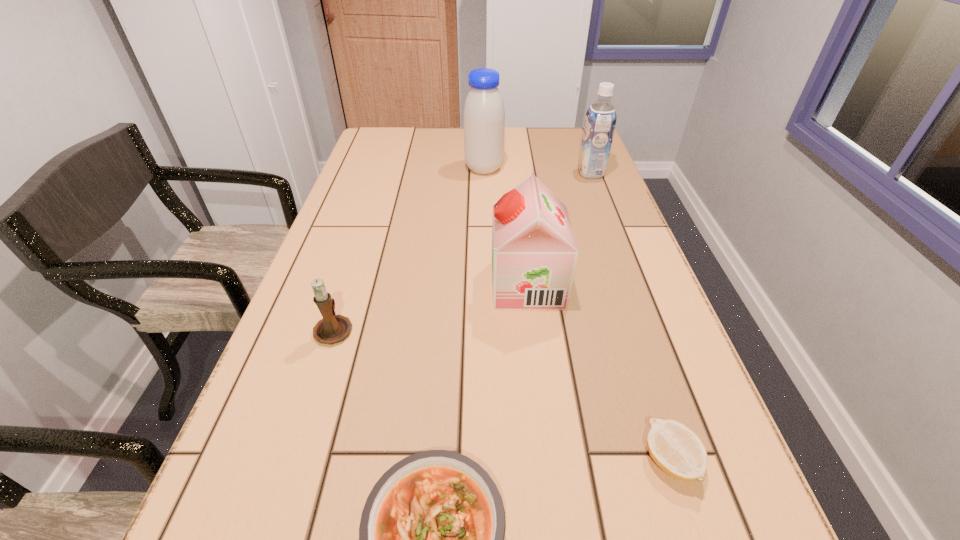
Where is `the rightmost soya milk`? The image size is (960, 540). the rightmost soya milk is located at coordinates (600, 121).

You are a GUI agent. You are given a task and a screenshot of the screen. Output one action in this format:
    pyautogui.click(x=<x>, y=<y>)
    Task: Click on the nearest soya milk
    This screenshot has width=960, height=540.
    Given the screenshot: What is the action you would take?
    pyautogui.click(x=534, y=253)

I want to click on the fourth tallest object, so click(x=332, y=328).

Where is `the leftmost object`? The width and height of the screenshot is (960, 540). the leftmost object is located at coordinates (332, 328).

In order to click on the shortest object in this screenshot , I will do `click(677, 450)`.

The width and height of the screenshot is (960, 540). What are the coordinates of `vacant space located 0.120m on the label of the rightmost soya milk` in the screenshot? It's located at (539, 173).

At what (x,y) coordinates should I click in order to perform the action: click on free location located 0.360m on the label of the rightmost soya milk. Please return your answer as a coordinate pair (x, y). Looking at the image, I should click on (458, 173).

At what (x,y) coordinates should I click in order to perform the action: click on free space located 0.230m on the label of the rightmost soya milk. Please return your answer as a coordinate pair (x, y). Looking at the image, I should click on (501, 173).

The image size is (960, 540). I want to click on free space located 0.360m with the cap open on the third farthest object, so click(327, 285).

Locate an element on the screen. free point located 0.340m with the cap open on the third farthest object is located at coordinates (336, 285).